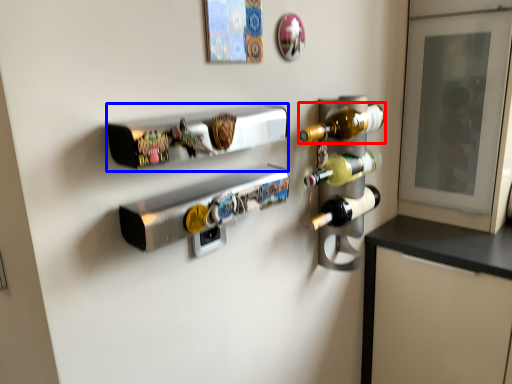
Question: Which object appears farthest to the camera in this image, bottle (highlighted by a red box) or shelf (highlighted by a blue box)?

Choices:
 (A) bottle
 (B) shelf

Answer: (A)